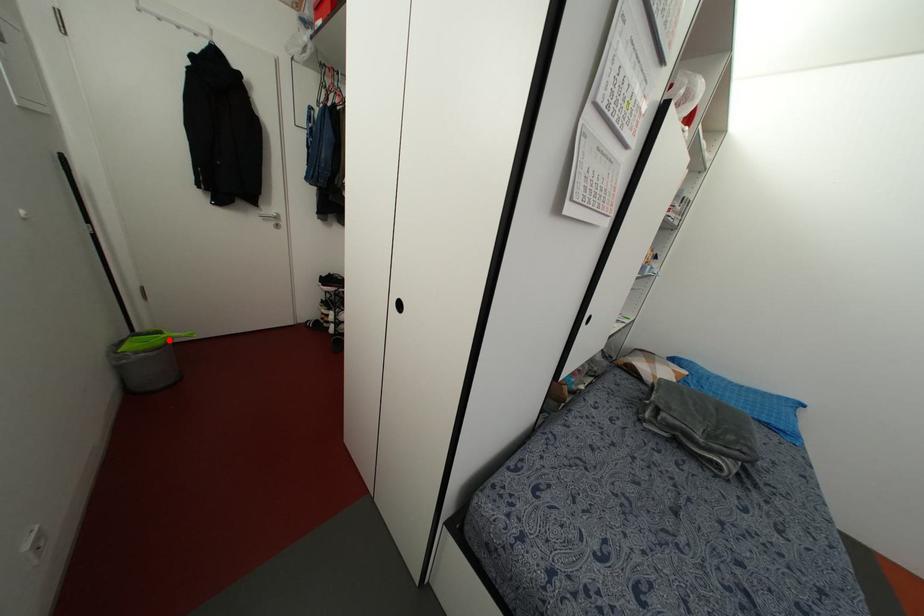
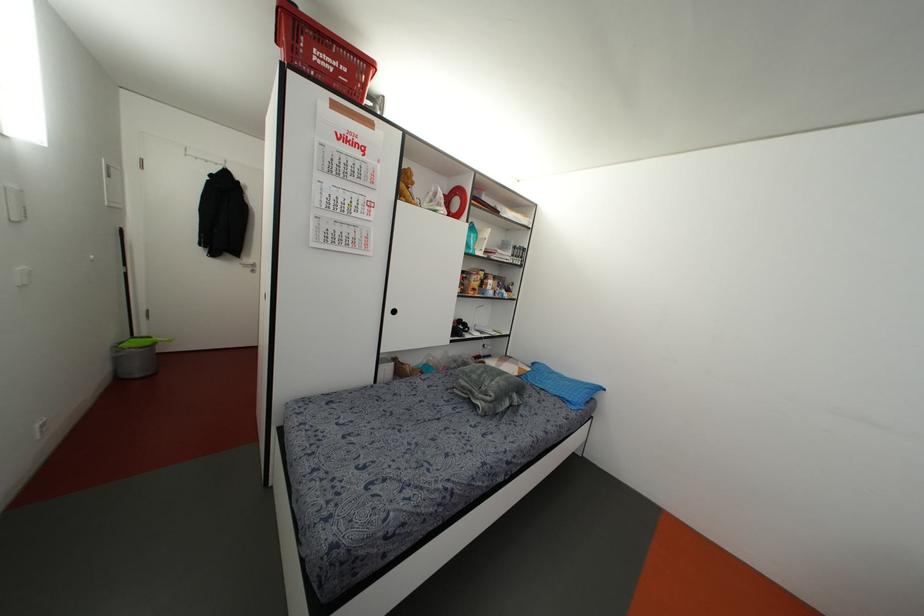
The point at the highlighted location is marked in the first image. Where is the corresponding point in the second image?

(153, 342)